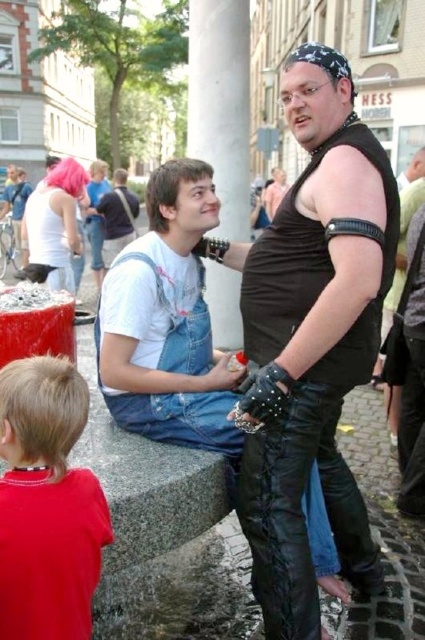
Which is above, black leather pants at center or denim overalls at center?

Positioned higher is black leather pants at center.

Does black leather pants at center have a smaller size compared to denim overalls at center?

Yes, black leather pants at center is smaller than denim overalls at center.

Does point (260, 342) come closer to viewer compared to point (110, 304)?

No.

Find the location of a particular element. black leather pants at center is located at coordinates (312, 340).

Can you confirm if black leather pants at center is positioned to the right of red cotton shirt at lower left?

Indeed, black leather pants at center is positioned on the right side of red cotton shirt at lower left.

Between point (345, 230) and point (39, 572), which one is positioned in front?

Point (39, 572) is more forward.

I want to click on black leather pants at center, so click(312, 340).

Is denim overalls at center smaller than red cotton shirt at lower left?

No, denim overalls at center is not smaller than red cotton shirt at lower left.

The height and width of the screenshot is (640, 425). I want to click on denim overalls at center, so click(167, 323).